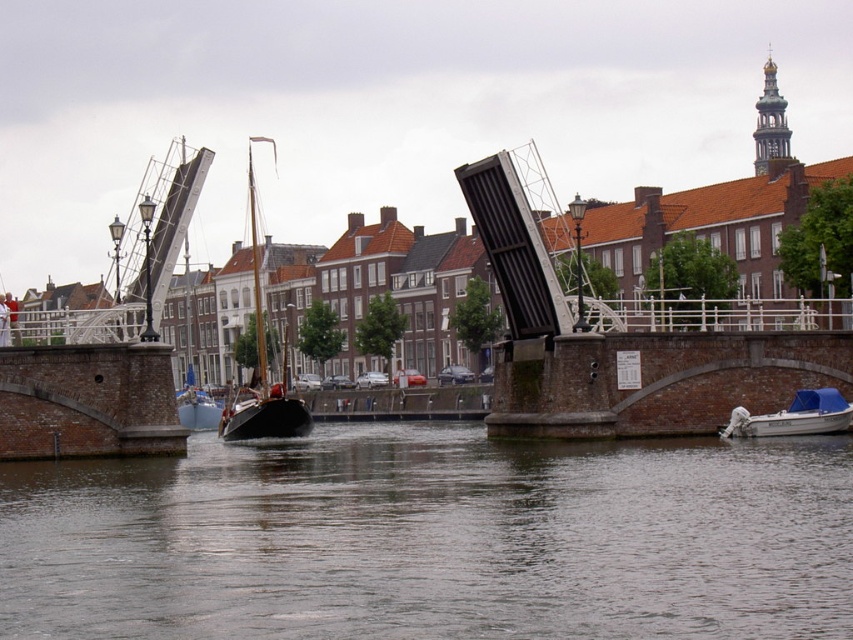
Consider the image. Is smooth water at center further to camera compared to white plastic boat at lower right?

No.

Can you confirm if smooth water at center is bigger than white plastic boat at lower right?

Indeed, smooth water at center has a larger size compared to white plastic boat at lower right.

Identify the location of smooth water at center. The height and width of the screenshot is (640, 853). (432, 540).

Identify the location of smooth water at center. (432, 540).

Can you confirm if wooden sailboat at center is positioned above white plastic boat at lower right?

Indeed, wooden sailboat at center is positioned over white plastic boat at lower right.

Locate an element on the screen. The height and width of the screenshot is (640, 853). wooden sailboat at center is located at coordinates (262, 360).

Looking at this image, is smooth water at center smaller than wooden sailboat at center?

Yes.

Based on the photo, does smooth water at center have a larger size compared to wooden sailboat at center?

No, smooth water at center is not bigger than wooden sailboat at center.

Between point (201, 611) and point (262, 394), which one is positioned behind?

The point (262, 394) is behind.

Image resolution: width=853 pixels, height=640 pixels. Find the location of `smooth water at center`. smooth water at center is located at coordinates coord(432,540).